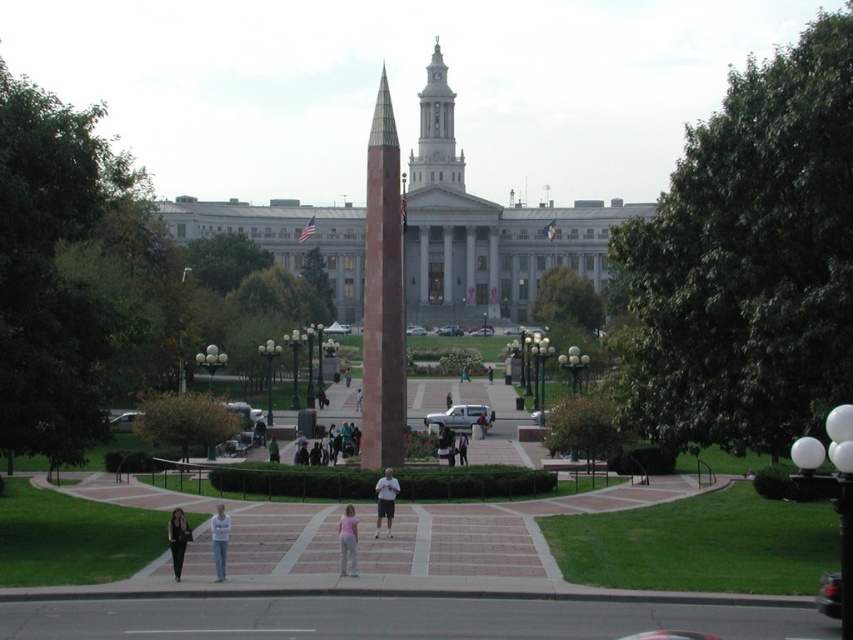
You are standing in the public square and want to walk from point (370, 356) to point (184, 548). Which direction should you move relative to your current position?

Since point (370, 356) is closer to you than point (184, 548), you should move away from yourself towards the direction of the background to reach point (184, 548).

You are standing at the center of the public square and want to find the black leather pants at lower left. Which direction should you face to see them?

The black leather pants at lower left are located at point (177, 540), which is to the lower left from your current position at the center. You should face the lower left direction to see them.